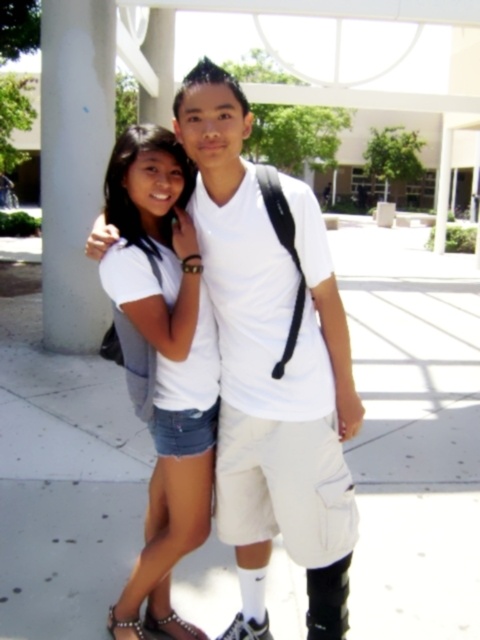
You are trying to locate the denim shorts at center in the image. According to the coordinates provided, where exactly is it positioned?

The denim shorts at center is located at point coordinates of 0.545 on the x axis and 0.344 on the y axis.